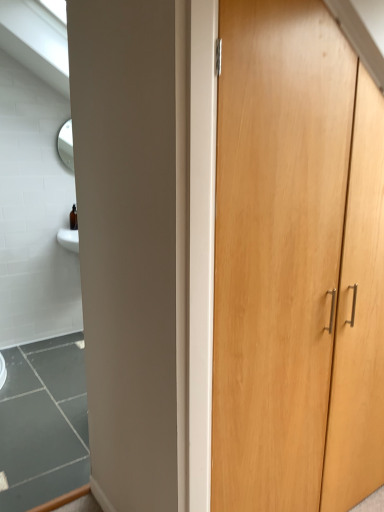
What do you see at coordinates (37, 31) in the screenshot?
I see `white glossy window at upper left` at bounding box center [37, 31].

Where is `white glossy window at upper left`? The width and height of the screenshot is (384, 512). white glossy window at upper left is located at coordinates (37, 31).

Based on the photo, measure the distance between point [45,39] and camera.

The depth of point [45,39] is 8.34 feet.

The image size is (384, 512). What do you see at coordinates (293, 263) in the screenshot?
I see `light wood cupboard at right` at bounding box center [293, 263].

Find the location of a particular element. This screenshot has width=384, height=512. light wood cupboard at right is located at coordinates (293, 263).

Locate an element on the screen. white glossy window at upper left is located at coordinates (37, 31).

Would you say white glossy window at upper left is to the left or to the right of light wood cupboard at right in the picture?

white glossy window at upper left is to the left of light wood cupboard at right.

Is white glossy window at upper left closer to camera compared to light wood cupboard at right?

That is False.

Is point (66, 44) positioned in front of point (334, 397)?

No, (66, 44) is further to viewer.

From the image's perspective, would you say white glossy window at upper left is shown under light wood cupboard at right?

No, from the image's perspective, white glossy window at upper left is not beneath light wood cupboard at right.

From a real-world perspective, which is physically above, white glossy window at upper left or light wood cupboard at right?

From a 3D spatial view, white glossy window at upper left is above.

Which object is wider, white glossy window at upper left or light wood cupboard at right?

Wider between the two is white glossy window at upper left.

Does white glossy window at upper left have a lesser height compared to light wood cupboard at right?

Indeed, white glossy window at upper left has a lesser height compared to light wood cupboard at right.

Looking at the image, does white glossy window at upper left seem bigger or smaller compared to light wood cupboard at right?

white glossy window at upper left is smaller than light wood cupboard at right.

Do you think white glossy window at upper left is within light wood cupboard at right, or outside of it?

white glossy window at upper left is not enclosed by light wood cupboard at right.

Are white glossy window at upper left and light wood cupboard at right making contact?

No, white glossy window at upper left is not with light wood cupboard at right.

Could you tell me if white glossy window at upper left is turned towards light wood cupboard at right?

No.

Find the location of `window above the light wood cupboard at right (from the image's perspective)`. window above the light wood cupboard at right (from the image's perspective) is located at coordinates (37, 31).

Between light wood cupboard at right and white glossy window at upper left, which one appears on the left side from the viewer's perspective?

white glossy window at upper left is more to the left.

Is the position of light wood cupboard at right more distant than that of white glossy window at upper left?

No, it is not.

Which is nearer, (267, 100) or (30, 32)?

Point (267, 100) is closer to the camera than point (30, 32).

From the image's perspective, is light wood cupboard at right located beneath white glossy window at upper left?

Yes, from the image's perspective, light wood cupboard at right is beneath white glossy window at upper left.

From a real-world perspective, is light wood cupboard at right above or below white glossy window at upper left?

In terms of real-world spatial position, light wood cupboard at right is below white glossy window at upper left.

Based on the photo, considering the sizes of objects light wood cupboard at right and white glossy window at upper left in the image provided, who is thinner, light wood cupboard at right or white glossy window at upper left?

Thinner between the two is light wood cupboard at right.

Is light wood cupboard at right taller or shorter than white glossy window at upper left?

light wood cupboard at right is taller than white glossy window at upper left.

Can you confirm if light wood cupboard at right is smaller than white glossy window at upper left?

No, light wood cupboard at right is not smaller than white glossy window at upper left.

Would you say light wood cupboard at right is inside or outside white glossy window at upper left?

light wood cupboard at right is spatially situated outside white glossy window at upper left.

Are light wood cupboard at right and white glossy window at upper left located far from each other?

Yes.

Could you tell me if light wood cupboard at right is facing white glossy window at upper left?

No, light wood cupboard at right is not turned towards white glossy window at upper left.

How different are the orientations of light wood cupboard at right and white glossy window at upper left in degrees?

91.1 degrees separate the facing orientations of light wood cupboard at right and white glossy window at upper left.

Locate an element on the screen. The width and height of the screenshot is (384, 512). cupboard below the white glossy window at upper left (from the image's perspective) is located at coordinates (293, 263).

Find the location of a particular element. The image size is (384, 512). cupboard that is below the white glossy window at upper left (from the image's perspective) is located at coordinates (293, 263).

Locate an element on the screen. cupboard to the right of white glossy window at upper left is located at coordinates (293, 263).